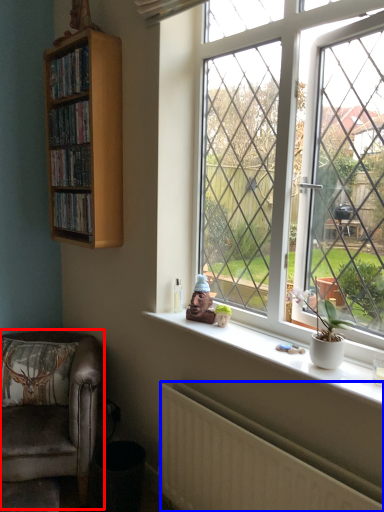
Question: Which object is closer to the camera taking this photo, chair (highlighted by a red box) or radiator (highlighted by a blue box)?

Choices:
 (A) chair
 (B) radiator

Answer: (B)